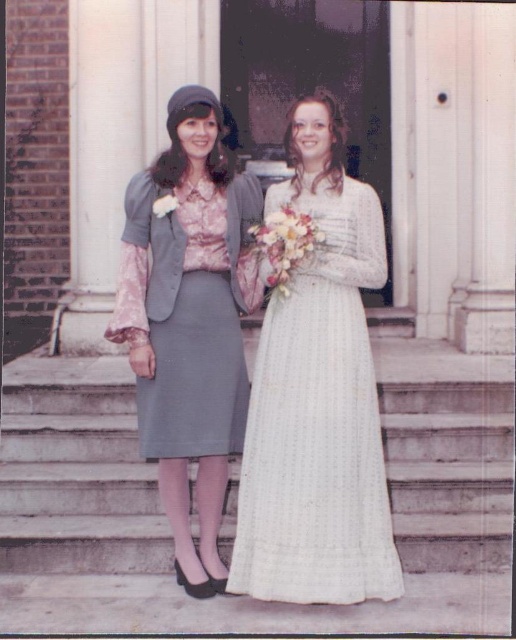
Question: Is smooth concrete stairs at center below matte gray skirt at center?

Choices:
 (A) no
 (B) yes

Answer: (B)

Question: Does smooth concrete stairs at center have a smaller size compared to white textured dress at center?

Choices:
 (A) no
 (B) yes

Answer: (A)

Question: Estimate the real-world distances between objects in this image. Which object is farther from the smooth concrete stairs at center?

Choices:
 (A) white textured dress at center
 (B) matte gray skirt at center

Answer: (B)

Question: Considering the real-world distances, which object is farthest from the matte gray skirt at center?

Choices:
 (A) white textured dress at center
 (B) smooth concrete stairs at center

Answer: (B)

Question: Among these points, which one is nearest to the camera?

Choices:
 (A) (348, 227)
 (B) (478, 394)

Answer: (A)

Question: Considering the relative positions of smooth concrete stairs at center and white textured dress at center in the image provided, where is smooth concrete stairs at center located with respect to white textured dress at center?

Choices:
 (A) above
 (B) below

Answer: (B)